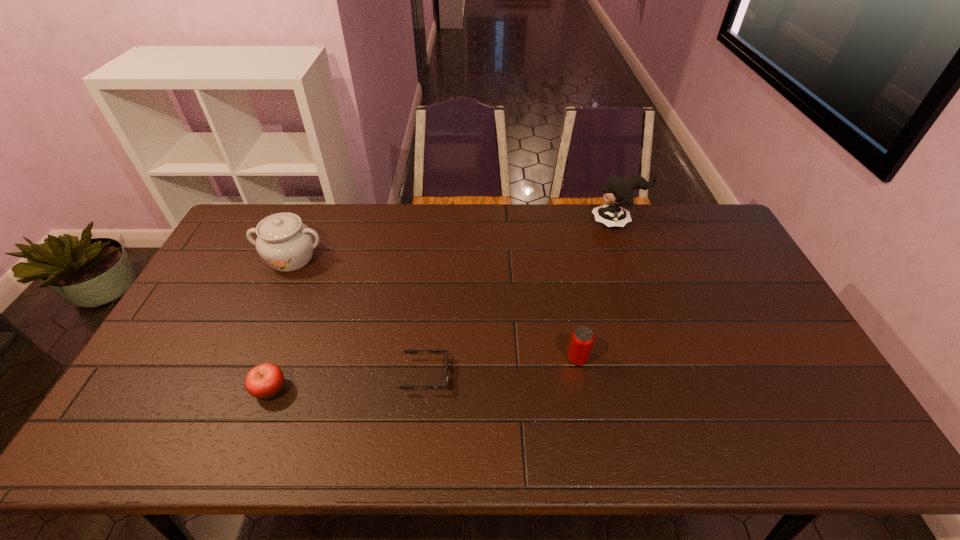
The image size is (960, 540). I want to click on vacant region at the far edge of the desktop, so click(x=347, y=213).

Where is `vacant space at the near edge of the desktop`? The width and height of the screenshot is (960, 540). vacant space at the near edge of the desktop is located at coordinates (678, 427).

This screenshot has width=960, height=540. I want to click on vacant space at the left edge, so (183, 314).

At what (x,y) coordinates should I click in order to perform the action: click on vacant space at the right edge of the desktop. Please return your answer as a coordinate pair (x, y). Looking at the image, I should click on (782, 358).

In order to click on blank space at the far left corner of the desktop in this screenshot , I will do `click(254, 234)`.

Where is `vacant area at the far right corner`? This screenshot has height=540, width=960. vacant area at the far right corner is located at coordinates (709, 218).

The height and width of the screenshot is (540, 960). I want to click on empty location between the chinaware and the shortest object, so click(x=359, y=316).

The image size is (960, 540). I want to click on empty space that is in between the shortest object and the farthest object, so click(521, 299).

I want to click on empty location between the fourth tallest object and the shortest object, so click(x=348, y=382).

Where is `free space between the chinaware and the apple`? free space between the chinaware and the apple is located at coordinates (280, 323).